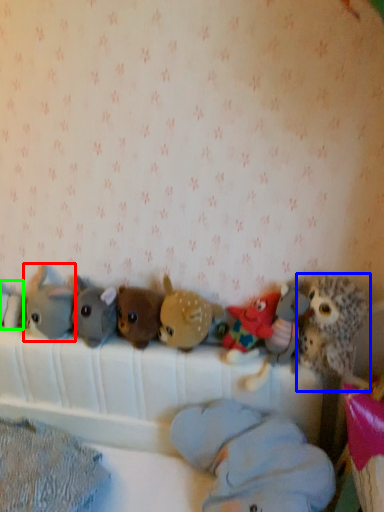
Question: Estimate the real-world distances between objects in this image. Which object is closer to toy (highlighted by a red box), toy (highlighted by a blue box) or toy (highlighted by a green box)?

Choices:
 (A) toy
 (B) toy

Answer: (B)